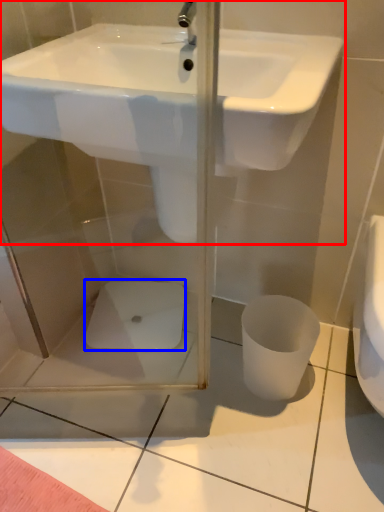
Question: Among these objects, which one is nearest to the camera, sink (highlighted by a red box) or porcelain (highlighted by a blue box)?

Choices:
 (A) sink
 (B) porcelain

Answer: (A)